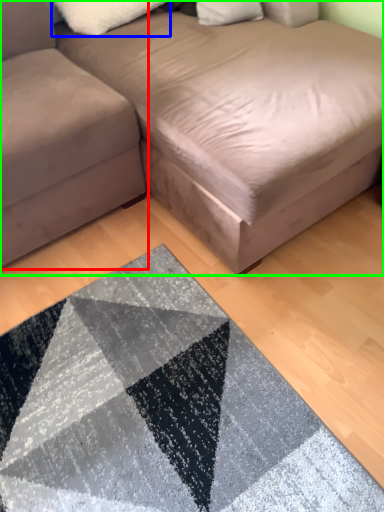
Question: Based on their relative distances, which object is nearer to studio couch (highlighted by a red box)? Choose from pillow (highlighted by a blue box) and studio couch (highlighted by a green box).

Choices:
 (A) pillow
 (B) studio couch

Answer: (B)